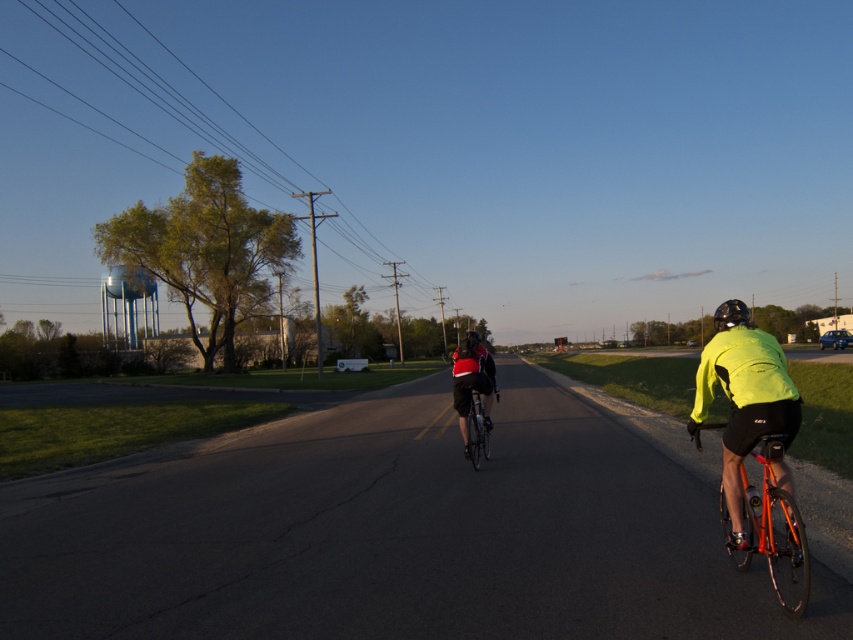
You are a photographer standing on the grassy area beside the road. You want to take a photo of the orange metallic bicycle at right and the shiny black helmet at right. Based on their positions, which object should you focus on first if you want to capture both in the same frame without moving your camera?

The orange metallic bicycle at right is located below the shiny black helmet at right, so you should focus on the shiny black helmet at right first to ensure both are in the frame.

You are a pedestrian standing at the edge of the road. You see a shiny metallic bicycle at center and a shiny black helmet at right. If you want to cross the road safely, which object should you pay attention to first and why?

You should pay attention to the shiny metallic bicycle at center first because it is closer to you than the shiny black helmet at right, which is 5.70 meters away.

You are a photographer trying to capture both the matte black jacket at center and the shiny black helmet at right in a single shot. Since you want to ensure both are visible, which object should you focus on first considering their sizes?

The matte black jacket at center has a smaller size compared to shiny black helmet at right, so you should focus on the shiny black helmet at right first as it is larger and easier to capture clearly.